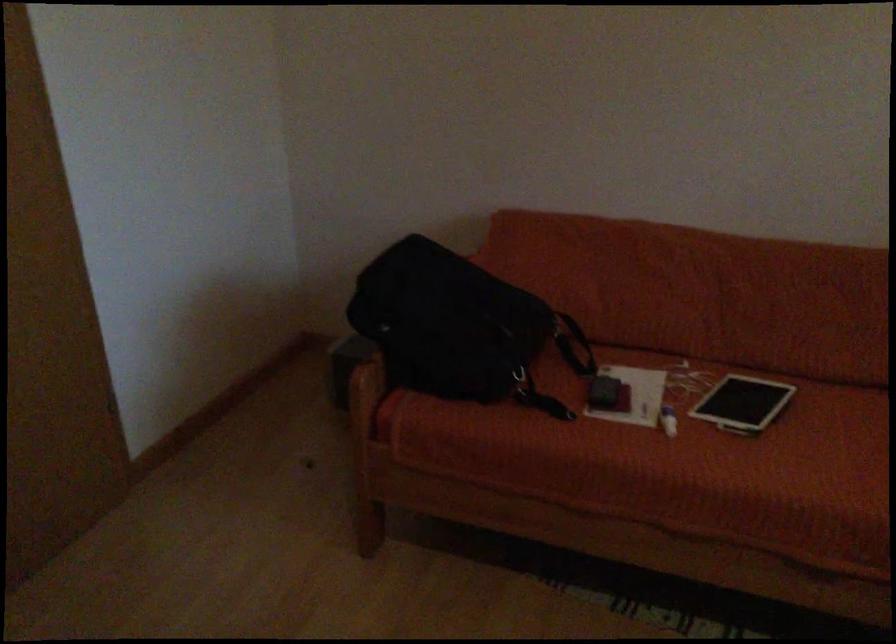
Where would you sit the sofa sitting surface? Please return your answer as a coordinate pair (x, y).

(823, 471)